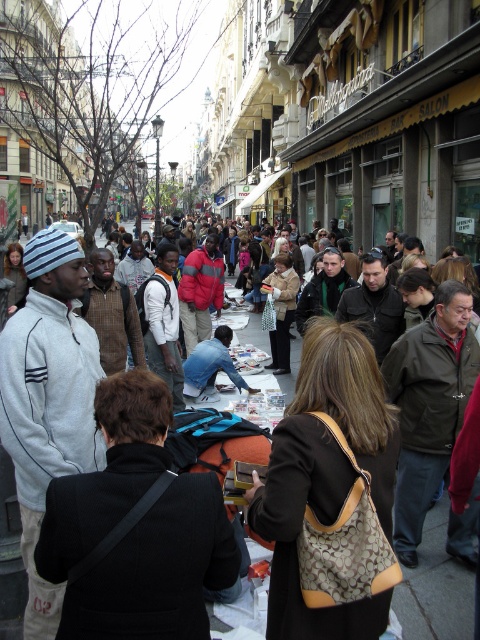
Who is more forward, (43, 598) or (252, 381)?

Point (43, 598) is in front.

How distant is white fleece jacket at left from dark brown leather jacket at center?

white fleece jacket at left is 6.14 meters away from dark brown leather jacket at center.

Is point (72, 452) farther from viewer compared to point (402, 595)?

No, it is in front of (402, 595).

The width and height of the screenshot is (480, 640). I want to click on white fleece jacket at left, so click(x=48, y=401).